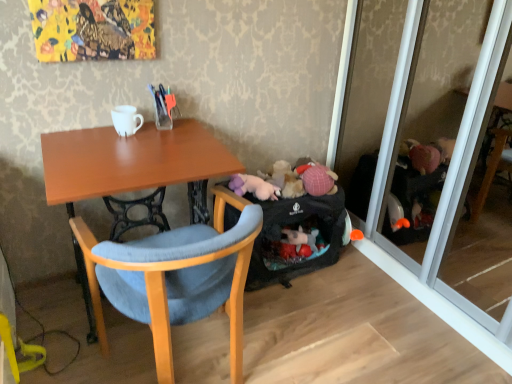
Question: From the image's perspective, would you say black fabric luggage at lower right is shown under wooden chair at center?

Choices:
 (A) no
 (B) yes

Answer: (A)

Question: Is black fabric luggage at lower right far away from wooden chair at center?

Choices:
 (A) yes
 (B) no

Answer: (B)

Question: Could wooden chair at center be considered to be inside black fabric luggage at lower right?

Choices:
 (A) yes
 (B) no

Answer: (B)

Question: Is the depth of black fabric luggage at lower right less than that of wooden chair at center?

Choices:
 (A) yes
 (B) no

Answer: (B)

Question: From a real-world perspective, is black fabric luggage at lower right physically above wooden chair at center?

Choices:
 (A) no
 (B) yes

Answer: (A)

Question: Can you confirm if black fabric luggage at lower right is bigger than wooden chair at center?

Choices:
 (A) no
 (B) yes

Answer: (A)

Question: Does white glossy coffee cup at upper center have a larger size compared to black fabric luggage at lower right?

Choices:
 (A) yes
 (B) no

Answer: (B)

Question: Is white glossy coffee cup at upper center wider than black fabric luggage at lower right?

Choices:
 (A) yes
 (B) no

Answer: (B)

Question: Is white glossy coffee cup at upper center aimed at black fabric luggage at lower right?

Choices:
 (A) yes
 (B) no

Answer: (B)

Question: Can you confirm if white glossy coffee cup at upper center is positioned to the left of black fabric luggage at lower right?

Choices:
 (A) no
 (B) yes

Answer: (B)

Question: Does white glossy coffee cup at upper center have a greater height compared to black fabric luggage at lower right?

Choices:
 (A) no
 (B) yes

Answer: (A)

Question: From a real-world perspective, does white glossy coffee cup at upper center sit lower than black fabric luggage at lower right?

Choices:
 (A) yes
 (B) no

Answer: (B)

Question: Is wooden chair at center bigger than white glossy coffee cup at upper center?

Choices:
 (A) yes
 (B) no

Answer: (A)